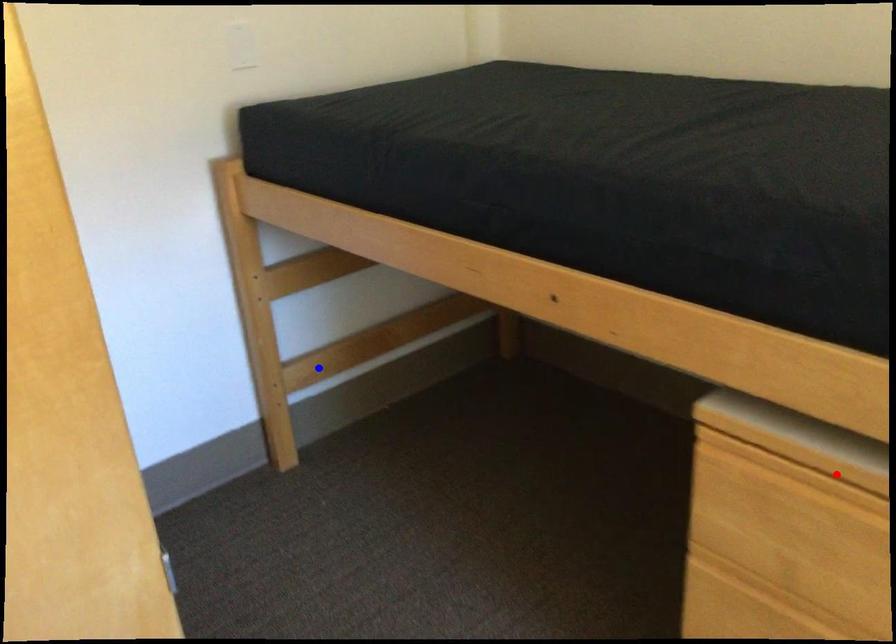
Question: Which of the two points in the image is closer to the camera?

Choices:
 (A) Blue point is closer.
 (B) Red point is closer.

Answer: (B)